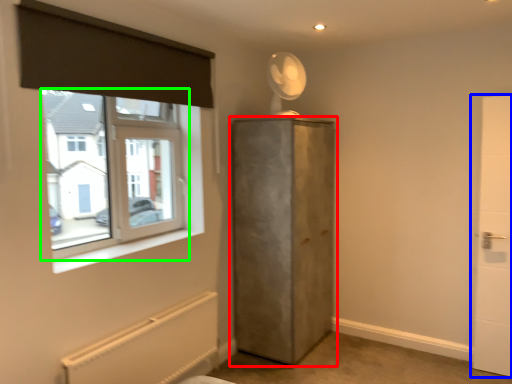
Question: Based on their relative distances, which object is farther from door (highlighted by a red box)? Choose from door (highlighted by a blue box) and window (highlighted by a green box).

Choices:
 (A) door
 (B) window

Answer: (A)